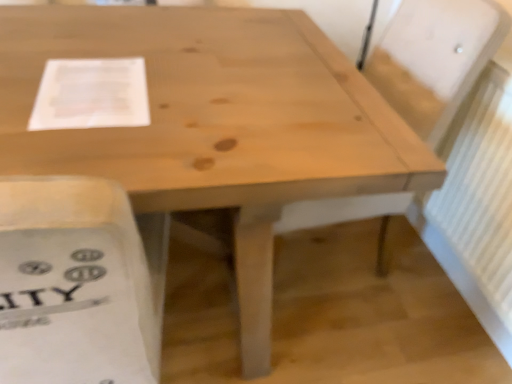
The width and height of the screenshot is (512, 384). In order to click on free spot behind white paper at upper left in this screenshot , I will do `click(138, 40)`.